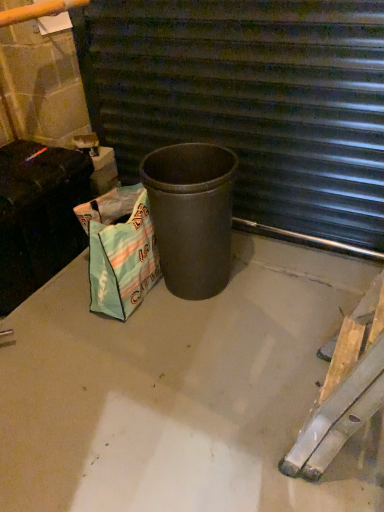
The image size is (384, 512). What do you see at coordinates (120, 250) in the screenshot?
I see `textured green shopping bag at lower left` at bounding box center [120, 250].

The image size is (384, 512). Identify the location of matte black trash can at center. (191, 215).

Where is `smooth concrete at center`? smooth concrete at center is located at coordinates (181, 392).

Is there a large distance between matte black trash can at center and matte black trash can at center?

No, matte black trash can at center is in close proximity to matte black trash can at center.

Does matte black trash can at center have a lesser width compared to matte black trash can at center?

Incorrect, the width of matte black trash can at center is not less than that of matte black trash can at center.

Does point (191, 278) appear closer or farther from the camera than point (290, 132)?

Clearly, point (191, 278) is closer to the camera than point (290, 132).

The image size is (384, 512). Find the location of `waste container that appears above the smooth concrete at center (from the image's perspective)`. waste container that appears above the smooth concrete at center (from the image's perspective) is located at coordinates (191, 215).

Considering the sizes of objects smooth concrete at center and matte black trash can at center in the image provided, who is shorter, smooth concrete at center or matte black trash can at center?

smooth concrete at center is shorter.

Is smooth concrete at center outside of matte black trash can at center?

Absolutely, smooth concrete at center is external to matte black trash can at center.

From the image's perspective, is smooth concrete at center below matte black trash can at center?

Yes, from the image's perspective, smooth concrete at center is beneath matte black trash can at center.

Is matte black trash can at center placed right next to matte black trash can at center?

matte black trash can at center and matte black trash can at center are clearly separated.

From a real-world perspective, who is located lower, matte black trash can at center or matte black trash can at center?

Result: matte black trash can at center is physically lower.

Is matte black trash can at center turned away from matte black trash can at center?

Absolutely, matte black trash can at center is directed away from matte black trash can at center.

From the image's perspective, does matte black trash can at center appear lower than matte black trash can at center?

No, from the image's perspective, matte black trash can at center is not beneath matte black trash can at center.

Is point (192, 203) closer to camera compared to point (281, 401)?

No, (192, 203) is further to viewer.

Between matte black trash can at center and smooth concrete at center, which one has larger width?

Wider between the two is smooth concrete at center.

Is matte black trash can at center facing away from smooth concrete at center?

No, smooth concrete at center is not at the back of matte black trash can at center.

Considering the sizes of matte black trash can at center and smooth concrete at center in the image, is matte black trash can at center taller or shorter than smooth concrete at center?

Clearly, matte black trash can at center is taller compared to smooth concrete at center.

Does smooth concrete at center turn towards textured green shopping bag at lower left?

No, smooth concrete at center is not aimed at textured green shopping bag at lower left.

Relative to textured green shopping bag at lower left, is smooth concrete at center in front or behind?

Clearly, smooth concrete at center is in front of textured green shopping bag at lower left.

Is smooth concrete at center thinner than textured green shopping bag at lower left?

In fact, smooth concrete at center might be wider than textured green shopping bag at lower left.

From a real-world perspective, is smooth concrete at center beneath textured green shopping bag at lower left?

Yes, from a real-world perspective, smooth concrete at center is below textured green shopping bag at lower left.

Considering the positions of point (110, 217) and point (191, 223), is point (110, 217) closer or farther from the camera than point (191, 223)?

Point (110, 217).

From the image's perspective, is textured green shopping bag at lower left under matte black trash can at center?

Yes.

Is the position of textured green shopping bag at lower left less distant than that of matte black trash can at center?

No, textured green shopping bag at lower left is further to the viewer.

In terms of width, does textured green shopping bag at lower left look wider or thinner when compared to matte black trash can at center?

textured green shopping bag at lower left is thinner than matte black trash can at center.

Is matte black trash can at center placed right next to textured green shopping bag at lower left?

No, matte black trash can at center is not making contact with textured green shopping bag at lower left.

Does point (162, 13) come closer to viewer compared to point (89, 242)?

No, (162, 13) is behind (89, 242).

Which is more to the left, matte black trash can at center or textured green shopping bag at lower left?

textured green shopping bag at lower left.

Is matte black trash can at center facing away from textured green shopping bag at lower left?

Yes.

The image size is (384, 512). Identify the location of waste container on the left of matte black trash can at center. (191, 215).

Locate an element on the screen. waste container on the right of smooth concrete at center is located at coordinates (191, 215).

Based on their spatial positions, is matte black trash can at center or textured green shopping bag at lower left closer to smooth concrete at center?

Among the two, textured green shopping bag at lower left is located nearer to smooth concrete at center.

Estimate the real-world distances between objects in this image. Which object is closer to matte black trash can at center, matte black trash can at center or smooth concrete at center?

Answer: Based on the image, matte black trash can at center appears to be nearer to matte black trash can at center.

Which object lies further to the anchor point matte black trash can at center, textured green shopping bag at lower left or smooth concrete at center?

Based on the image, smooth concrete at center appears to be further to matte black trash can at center.

From the image, which object appears to be nearer to matte black trash can at center, matte black trash can at center or textured green shopping bag at lower left?

The object closer to matte black trash can at center is textured green shopping bag at lower left.

When comparing their distances from matte black trash can at center, does matte black trash can at center or smooth concrete at center seem closer?

The object closer to matte black trash can at center is smooth concrete at center.

Based on the photo, from the image, which object appears to be nearer to textured green shopping bag at lower left, matte black trash can at center or smooth concrete at center?

Based on the image, smooth concrete at center appears to be nearer to textured green shopping bag at lower left.

In the scene shown: Which object lies nearer to the anchor point matte black trash can at center, smooth concrete at center or textured green shopping bag at lower left?

Among the two, textured green shopping bag at lower left is located nearer to matte black trash can at center.

Estimate the real-world distances between objects in this image. Which object is further from matte black trash can at center, textured green shopping bag at lower left or matte black trash can at center?

Based on the image, matte black trash can at center appears to be further to matte black trash can at center.

In order to click on shopping bag between matte black trash can at center and smooth concrete at center in the vertical direction in this screenshot , I will do `click(120, 250)`.

Identify the location of waste container between smooth concrete at center and textured green shopping bag at lower left in the front-back direction. This screenshot has height=512, width=384. (191, 215).

Locate an element on the screen. The width and height of the screenshot is (384, 512). waste container that lies between matte black trash can at center and textured green shopping bag at lower left from top to bottom is located at coordinates (191, 215).

Find the location of a particular element. The image size is (384, 512). waste container between matte black trash can at center and smooth concrete at center in the up-down direction is located at coordinates (191, 215).